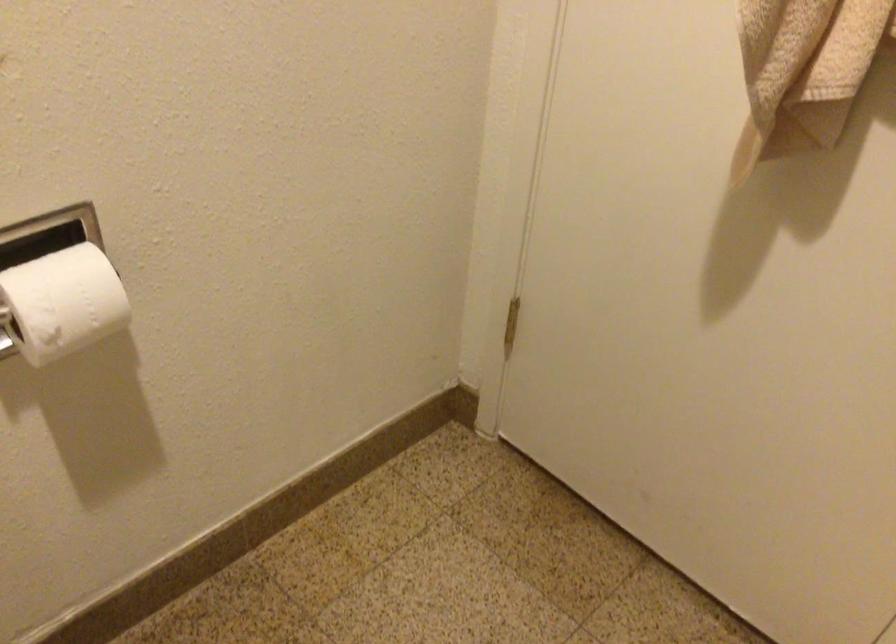
This screenshot has width=896, height=644. I want to click on white toilet paper, so click(x=62, y=303).